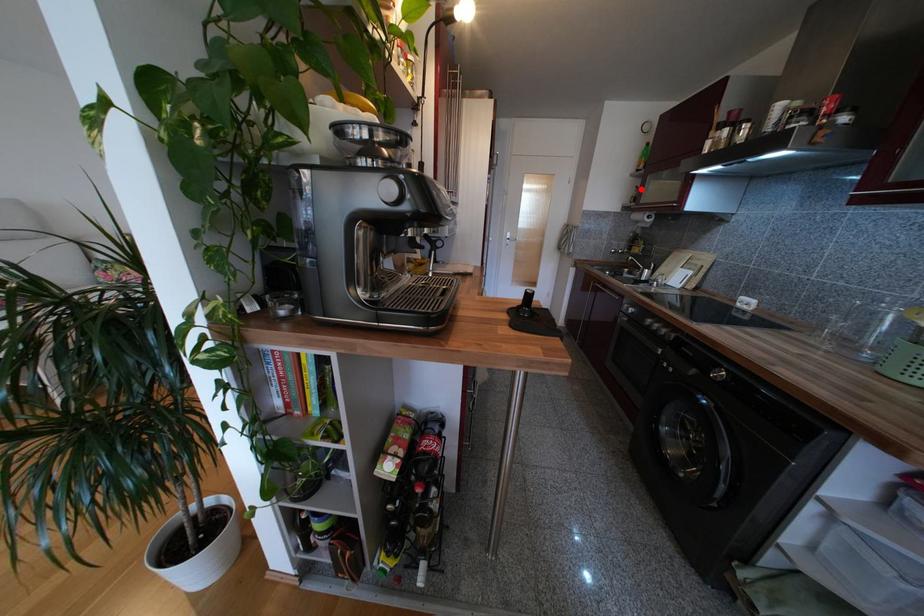
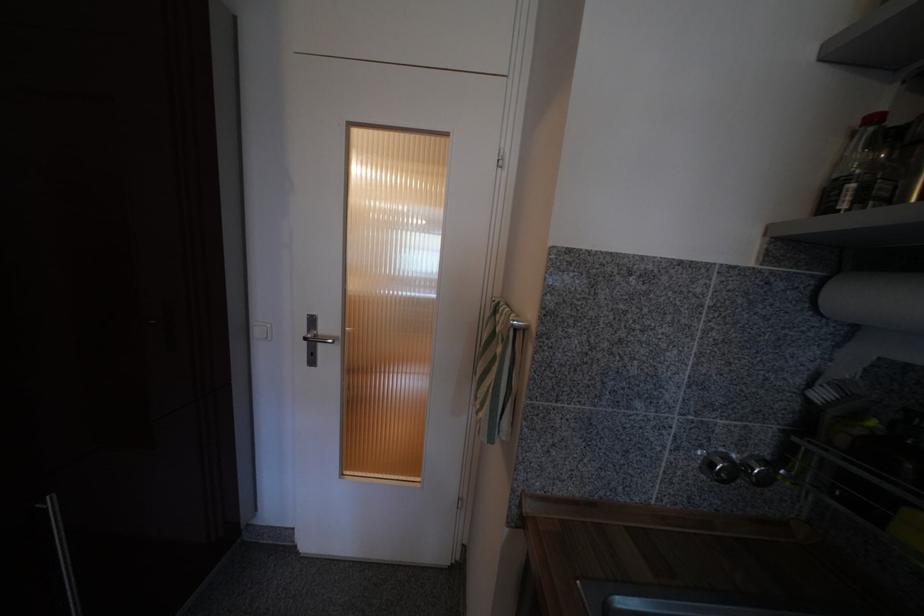
Where in the second image is the point corresponding to the highlighted location from the first image?

(879, 121)